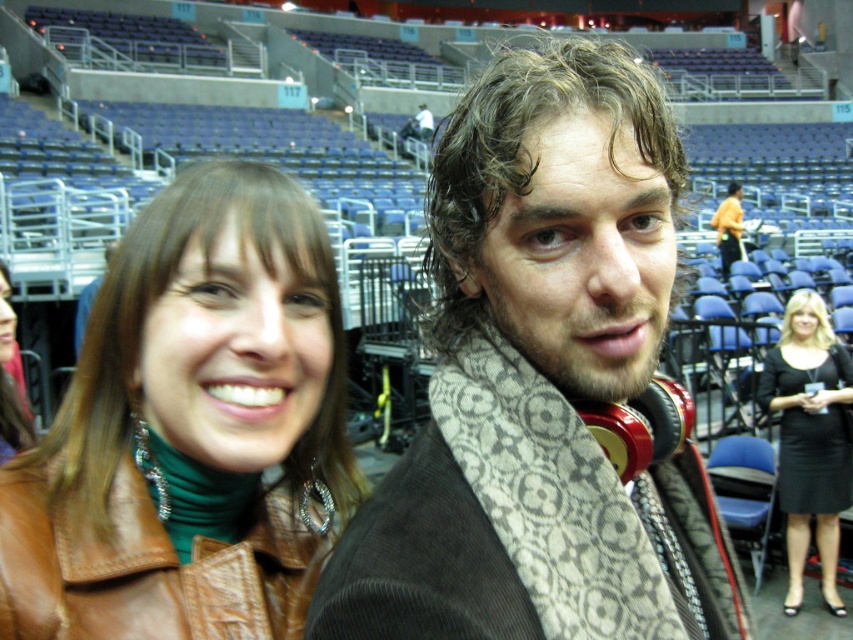
Question: Which point is farther from the camera taking this photo?

Choices:
 (A) (630, 572)
 (B) (693, 536)
 (C) (839, 444)

Answer: (C)

Question: Is the position of patterned scarf at center more distant than that of black satin dress at lower right?

Choices:
 (A) yes
 (B) no

Answer: (B)

Question: Which of the following is the closest to the observer?

Choices:
 (A) beige patterned scarf at center
 (B) black satin dress at lower right
 (C) brown leather jacket at center
 (D) patterned scarf at center

Answer: (D)

Question: Which of these objects is positioned closest to the black satin dress at lower right?

Choices:
 (A) brown leather jacket at center
 (B) patterned scarf at center
 (C) beige patterned scarf at center

Answer: (B)

Question: In this image, where is patterned scarf at center located relative to brown leather jacket at center?

Choices:
 (A) above
 (B) below

Answer: (A)

Question: Can you confirm if beige patterned scarf at center is thinner than black satin dress at lower right?

Choices:
 (A) yes
 (B) no

Answer: (A)